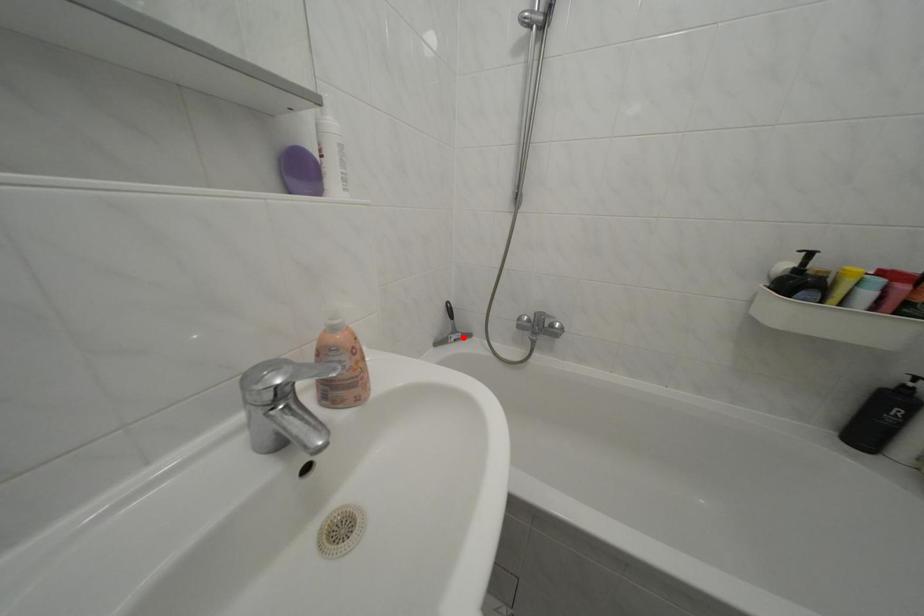
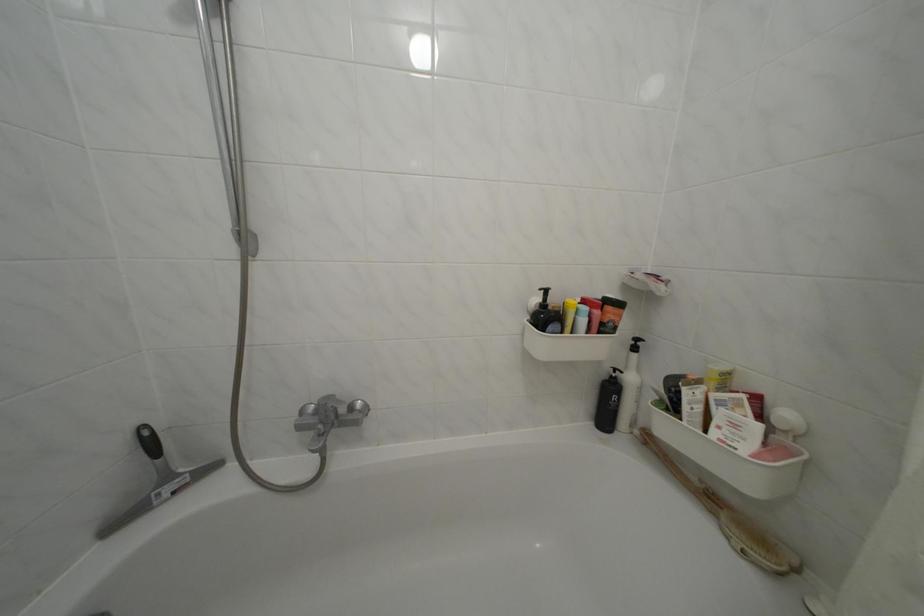
Find the pixel in the second image that matches the highlighted location in the first image.

(176, 484)